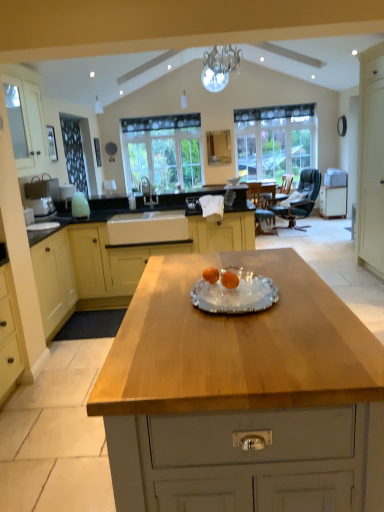
Question: From the image's perspective, would you say wooden table at center is shown under clear glass window at center, the 1th window when ordered from left to right?

Choices:
 (A) yes
 (B) no

Answer: (A)

Question: Considering the relative positions of wooden table at center and clear glass window at center, the 1th window when ordered from left to right, in the image provided, is wooden table at center to the right of clear glass window at center, the 1th window when ordered from left to right, from the viewer's perspective?

Choices:
 (A) no
 (B) yes

Answer: (B)

Question: Is wooden table at center placed right next to clear glass window at center, acting as the 2th window starting from the right?

Choices:
 (A) no
 (B) yes

Answer: (A)

Question: Is wooden table at center outside clear glass window at center, the 1th window when ordered from left to right?

Choices:
 (A) yes
 (B) no

Answer: (A)

Question: Does wooden table at center have a lesser width compared to clear glass window at center, acting as the 2th window starting from the right?

Choices:
 (A) no
 (B) yes

Answer: (A)

Question: Considering the positions of point (152, 197) and point (3, 78), is point (152, 197) closer or farther from the camera than point (3, 78)?

Choices:
 (A) farther
 (B) closer

Answer: (A)

Question: From the image's perspective, relative to white wood cabinet at left, which ranks as the first cabinetry in left-to-right order, is white glossy sink at center above or below?

Choices:
 (A) above
 (B) below

Answer: (B)

Question: Would you say white glossy sink at center is to the left or to the right of white wood cabinet at left, which ranks as the first cabinetry in left-to-right order, in the picture?

Choices:
 (A) left
 (B) right

Answer: (B)

Question: Considering the positions of white glossy sink at center and white wood cabinet at left, which ranks as the first cabinetry in left-to-right order, in the image, is white glossy sink at center bigger or smaller than white wood cabinet at left, which ranks as the first cabinetry in left-to-right order,?

Choices:
 (A) small
 (B) big

Answer: (A)

Question: Based on their sizes in the image, would you say clear glass window at center, the 2th window from the left, is bigger or smaller than white wood cabinet at right, the first cabinetry viewed from the back?

Choices:
 (A) big
 (B) small

Answer: (A)

Question: Considering their positions, is clear glass window at center, the 1th window positioned from the right, located in front of or behind white wood cabinet at right, the first cabinetry positioned from the right?

Choices:
 (A) front
 (B) behind

Answer: (B)

Question: Considering the positions of clear glass window at center, the 1th window positioned from the right, and white wood cabinet at right, the first cabinetry viewed from the back, in the image, is clear glass window at center, the 1th window positioned from the right, taller or shorter than white wood cabinet at right, the first cabinetry viewed from the back,?

Choices:
 (A) short
 (B) tall

Answer: (B)

Question: From a real-world perspective, relative to white wood cabinet at right, the first cabinetry positioned from the right, is clear glass window at center, the 2th window from the left, vertically above or below?

Choices:
 (A) above
 (B) below

Answer: (A)

Question: Is light wood/texture cabinet at center, the third cabinetry from the front, in front of or behind white glossy sink at center in the image?

Choices:
 (A) behind
 (B) front

Answer: (B)

Question: Considering the positions of light wood/texture cabinet at center, acting as the 3th cabinetry starting from the right, and white glossy sink at center in the image, is light wood/texture cabinet at center, acting as the 3th cabinetry starting from the right, bigger or smaller than white glossy sink at center?

Choices:
 (A) big
 (B) small

Answer: (A)